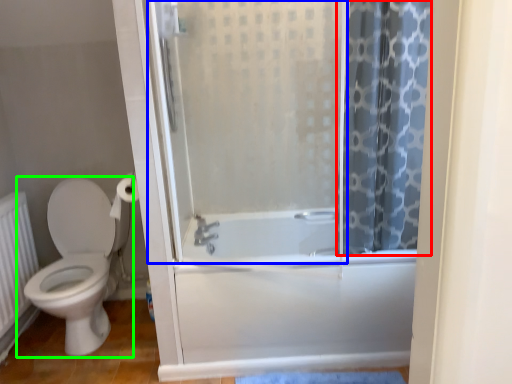
Question: Which is farther away from shower curtain (highlighted by a red box)? screen door (highlighted by a blue box) or toilet (highlighted by a green box)?

Choices:
 (A) screen door
 (B) toilet

Answer: (B)